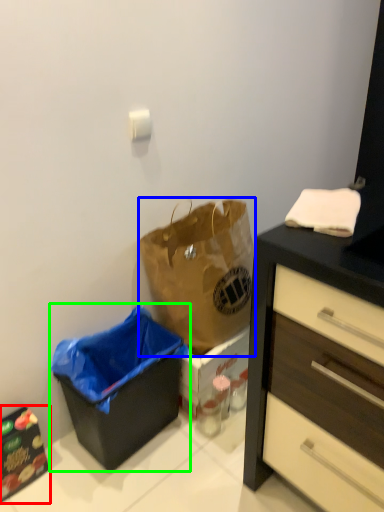
Question: Estimate the real-world distances between objects in this image. Which object is closer to cabinetry (highlighted by a red box), handbag (highlighted by a blue box) or recycling bin (highlighted by a green box)?

Choices:
 (A) handbag
 (B) recycling bin

Answer: (B)